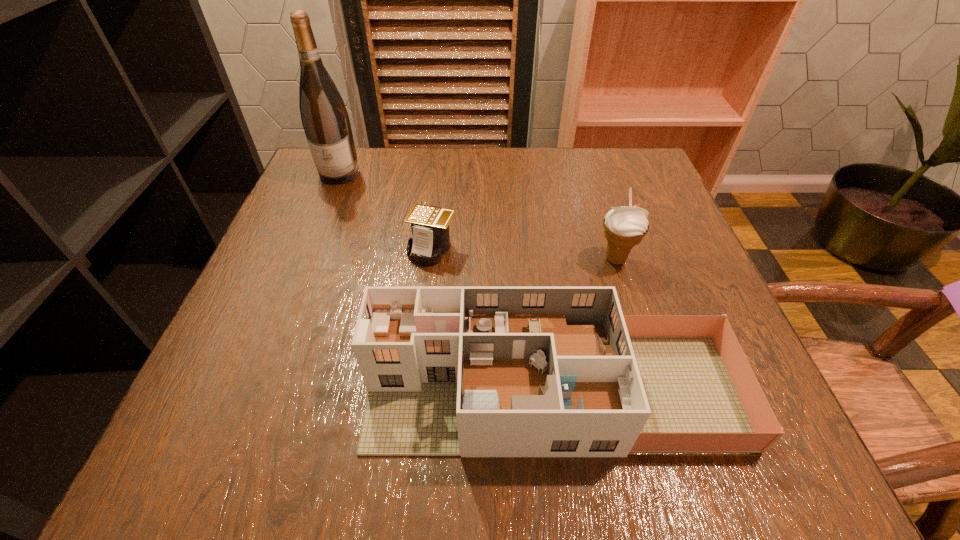
You are a GUI agent. You are given a task and a screenshot of the screen. Output one action in this format:
    pyautogui.click(x=<x>, y=<y>)
    Task: Click on the free area in between the dollhouse and the leftmost object
    The height and width of the screenshot is (540, 960).
    Given the screenshot: What is the action you would take?
    pyautogui.click(x=445, y=282)

The width and height of the screenshot is (960, 540). Find the location of `vacant space that is in between the shortest object and the icecream`. vacant space that is in between the shortest object and the icecream is located at coordinates pos(524,254).

You are a GUI agent. You are given a task and a screenshot of the screen. Output one action in this format:
    pyautogui.click(x=<x>, y=<y>)
    Task: Click on the free space that is in between the farthest object and the nearest object
    
    Given the screenshot: What is the action you would take?
    click(x=445, y=282)

At what (x,y) coordinates should I click in order to perform the action: click on object that is the closest to the icecream. Please return your answer as a coordinate pair (x, y). Looking at the image, I should click on (451, 371).

Select which object appears as the second closest to the farthest object. Please provide its 2D coordinates. Your answer should be formatted as a tuple, i.e. [(x, y)], where the tuple contains the x and y coordinates of a point satisfying the conditions above.

[(451, 371)]

Where is `vacant space that satisfies the following two spatial constraints: 1. on the front side of the calculator; 2. on the left side of the icecream`? The width and height of the screenshot is (960, 540). vacant space that satisfies the following two spatial constraints: 1. on the front side of the calculator; 2. on the left side of the icecream is located at coordinates (431, 259).

Image resolution: width=960 pixels, height=540 pixels. I want to click on vacant space that satisfies the following two spatial constraints: 1. on the label of the tallest object; 2. on the right side of the shortest object, so click(x=310, y=249).

Locate an element on the screen. The height and width of the screenshot is (540, 960). vacant space that satisfies the following two spatial constraints: 1. on the label of the icecream; 2. on the right side of the wine bottle is located at coordinates (306, 259).

This screenshot has height=540, width=960. I want to click on vacant region that satisfies the following two spatial constraints: 1. on the label of the calculator; 2. on the left side of the wine bottle, so click(310, 249).